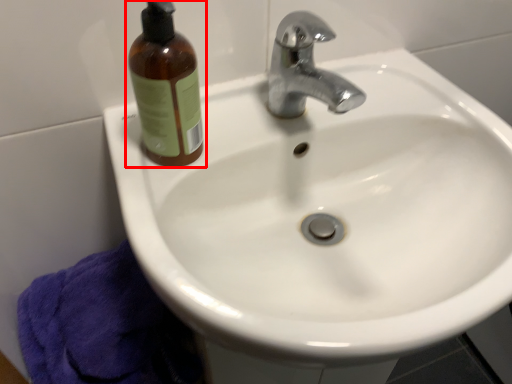
Question: From the image's perspective, considering the relative positions of bottle (annotated by the red box) and bath towel in the image provided, where is bottle (annotated by the red box) located with respect to the staircase?

Choices:
 (A) above
 (B) below

Answer: (A)